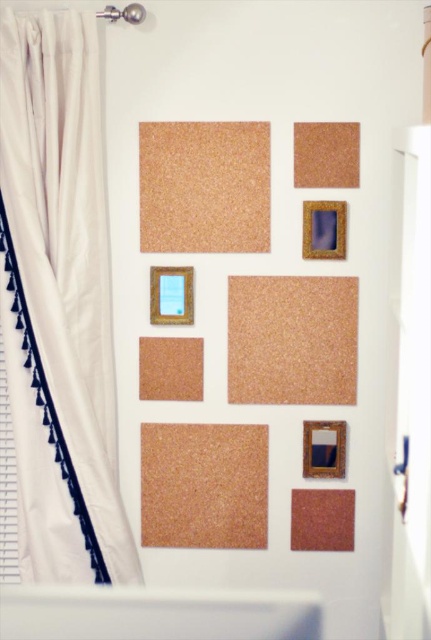
Which is more to the left, white fabric curtain at left or gold textured picture frame at upper center?

Positioned to the left is white fabric curtain at left.

You are a GUI agent. You are given a task and a screenshot of the screen. Output one action in this format:
    pyautogui.click(x=<x>, y=<y>)
    Task: Click on the white fabric curtain at left
    The height and width of the screenshot is (640, 431).
    Given the screenshot: What is the action you would take?
    pyautogui.click(x=59, y=301)

Identify the location of white fabric curtain at left. (59, 301).

Which of these two, white fabric curtain at left or gold textured picture frame at center, stands shorter?

Standing shorter between the two is gold textured picture frame at center.

Between white fabric curtain at left and gold textured picture frame at center, which one is positioned higher?

Positioned higher is gold textured picture frame at center.

Locate an element on the screen. The height and width of the screenshot is (640, 431). white fabric curtain at left is located at coordinates (59, 301).

This screenshot has height=640, width=431. Identify the location of white fabric curtain at left. (59, 301).

Does white fabric curtain at left have a greater height compared to gold metallic picture frame at lower right?

Yes, white fabric curtain at left is taller than gold metallic picture frame at lower right.

Is point (18, 200) farther from camera compared to point (321, 476)?

No, (18, 200) is closer to viewer.

This screenshot has width=431, height=640. In order to click on white fabric curtain at left in this screenshot , I will do `click(59, 301)`.

You are a GUI agent. You are given a task and a screenshot of the screen. Output one action in this format:
    pyautogui.click(x=<x>, y=<y>)
    Task: Click on the white fabric curtain at left
    The height and width of the screenshot is (640, 431).
    Given the screenshot: What is the action you would take?
    pyautogui.click(x=59, y=301)